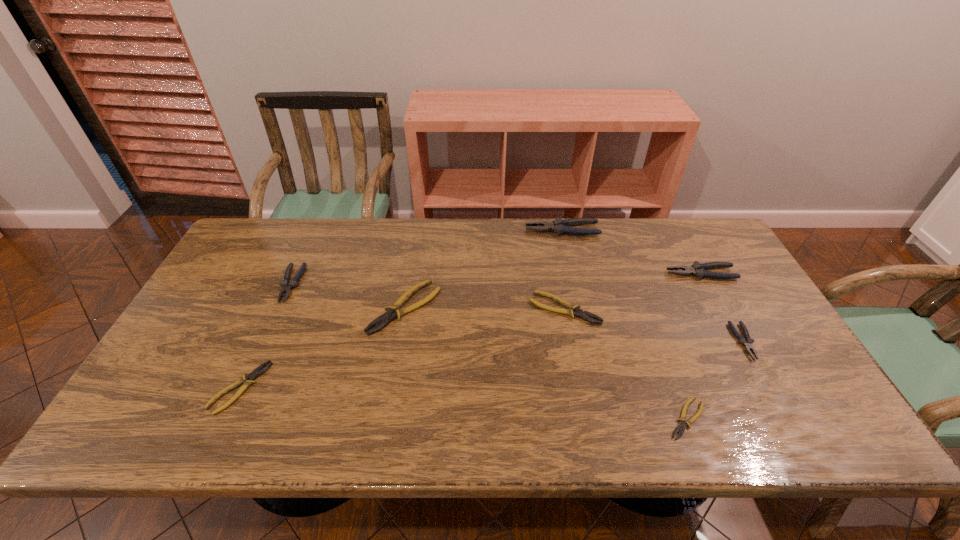
This screenshot has height=540, width=960. What are the coordinates of `free region that satisfies the following two spatial constraints: 1. at the gripping part of the tallest object; 2. at the gripping part of the leftmost gray pliers` in the screenshot? It's located at (574, 284).

Where is `vacant space that satisfies the following two spatial constraints: 1. at the gripping part of the leftmost gray pliers; 2. on the left side of the third smallest yellow pliers`? vacant space that satisfies the following two spatial constraints: 1. at the gripping part of the leftmost gray pliers; 2. on the left side of the third smallest yellow pliers is located at coordinates (280, 308).

You are a GUI agent. You are given a task and a screenshot of the screen. Output one action in this format:
    pyautogui.click(x=<x>, y=<y>)
    Task: Click on the vacant space that satisfies the following two spatial constraints: 1. at the gripping part of the biggest gray pliers; 2. on the right side of the smallest yellow pliers
    The height and width of the screenshot is (540, 960).
    Given the screenshot: What is the action you would take?
    pyautogui.click(x=605, y=418)